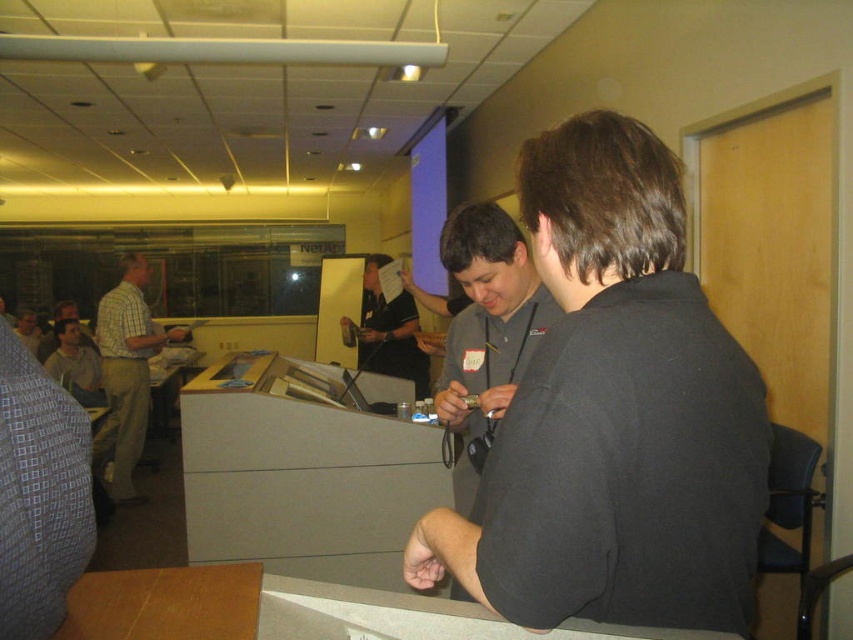
Question: Which object appears farthest from the camera in this image?

Choices:
 (A) light brown shirt at left
 (B) plaid shirt at left

Answer: (A)

Question: Does matte gray shirt at center have a smaller size compared to light brown wood table at lower center?

Choices:
 (A) no
 (B) yes

Answer: (A)

Question: Among these points, which one is farthest from the camera?

Choices:
 (A) (369, 324)
 (B) (517, 628)

Answer: (A)

Question: Does black shirt at center appear on the right side of light brown wood table at lower center?

Choices:
 (A) yes
 (B) no

Answer: (A)

Question: Is light brown wood table at lower center bigger than light brown leather jacket at lower left?

Choices:
 (A) yes
 (B) no

Answer: (B)

Question: Among these points, which one is farthest from the camera?

Choices:
 (A) pos(532,301)
 (B) pos(18,332)

Answer: (B)